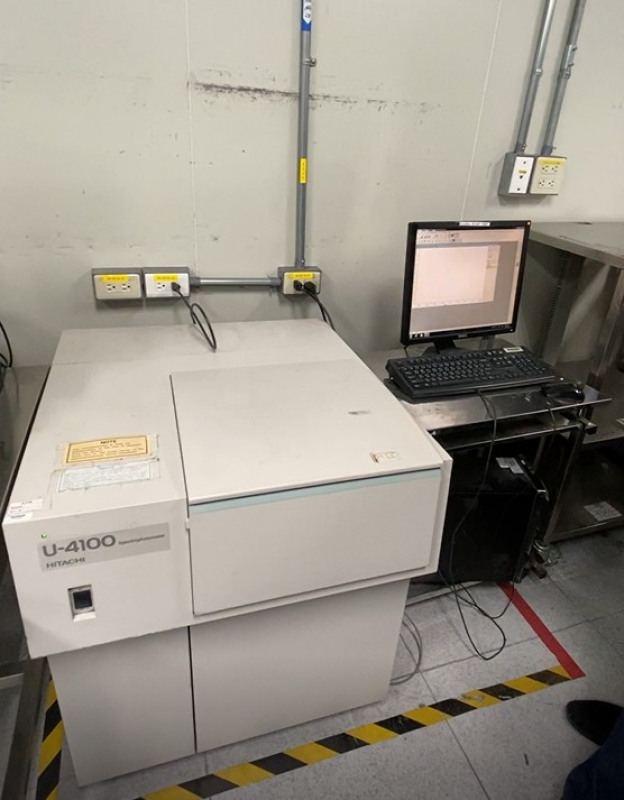
At what (x,y) coordinates should I click in order to perform the action: click on flat surfaces. Please return your answer as a coordinate pair (x, y). Looking at the image, I should click on (271, 394), (460, 410), (598, 240), (606, 422), (592, 505), (509, 734), (222, 158).